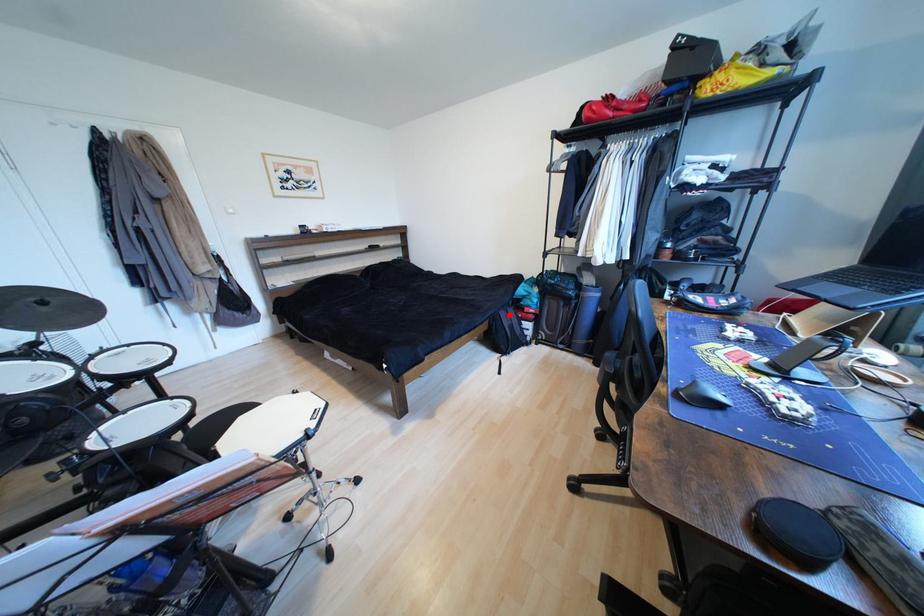
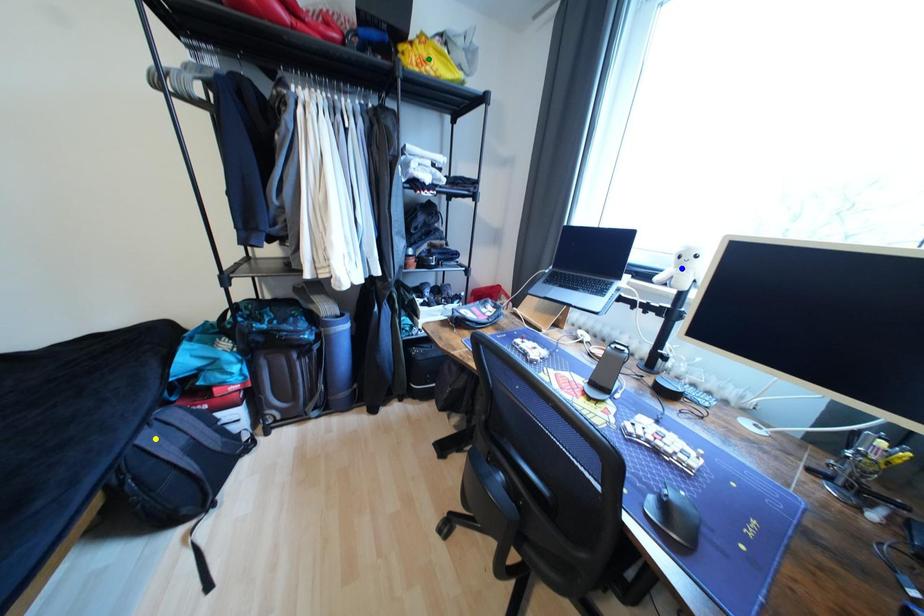
Question: I am providing you with two images of the same scene from different viewpoints. A red point is marked on the first image. You are given multiple points on the second image. Which point in image 2 is actually the same real-world point as the red point in image 1?

Choices:
 (A) blue point
 (B) yellow point
 (C) green point

Answer: (B)